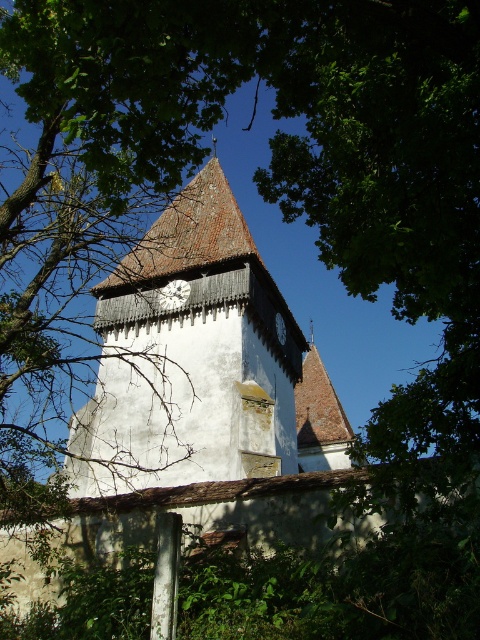
Where is `white wooden clock at center`? The image size is (480, 640). white wooden clock at center is located at coordinates (173, 294).

Which of these two, white wooden clock at center or white wooden clock at upper center, stands shorter?

white wooden clock at center is shorter.

This screenshot has height=640, width=480. I want to click on white wooden clock at center, so click(173, 294).